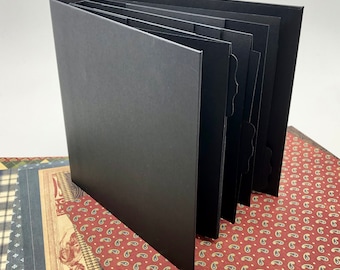
At what (x,y) coordinates should I click in order to perform the action: click on wall. Please return your answer as a coordinate pair (x, y). The width and height of the screenshot is (340, 270). Looking at the image, I should click on coord(29,79).